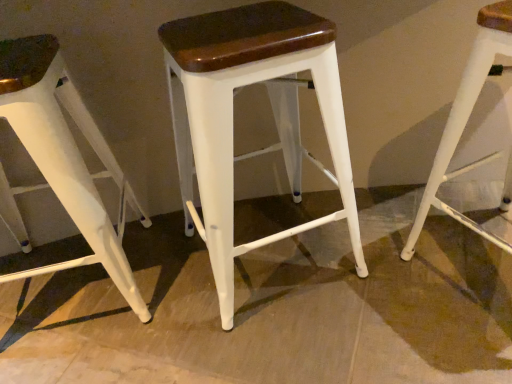
Where is `free space above white matte stool at center, the 2th stool from the left (from a real-world perspective)`? The image size is (512, 384). free space above white matte stool at center, the 2th stool from the left (from a real-world perspective) is located at coordinates point(241,26).